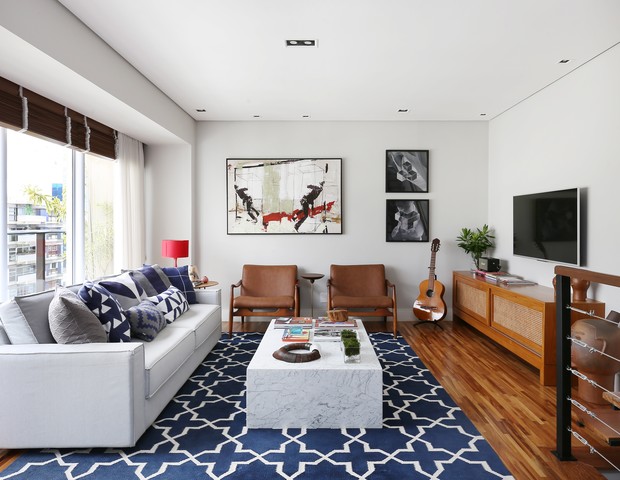
I want to click on tv, so click(x=544, y=215).